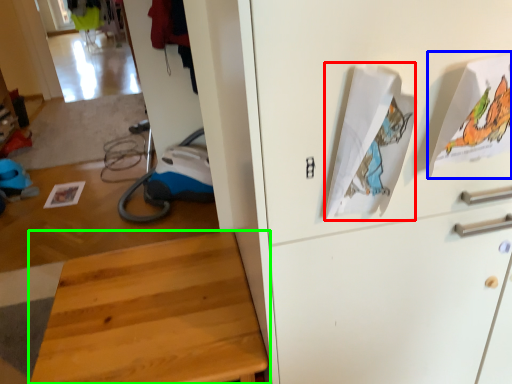
Question: Which object is the farthest from wrapping paper (highlighted by a red box)? Choose among these: wrapping paper (highlighted by a blue box) or furniture (highlighted by a green box).

Choices:
 (A) wrapping paper
 (B) furniture

Answer: (B)